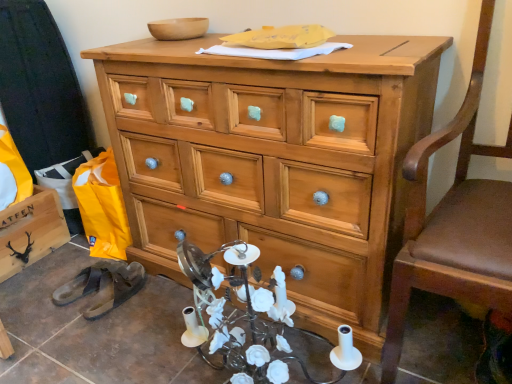
You are a GUI agent. You are given a task and a screenshot of the screen. Output one action in this format:
    pyautogui.click(x=<x>, y=<y>)
    Task: Click on the blank space to the left of black rubber sandals at lower left
    The image size is (512, 384).
    Given the screenshot: What is the action you would take?
    pyautogui.click(x=47, y=304)